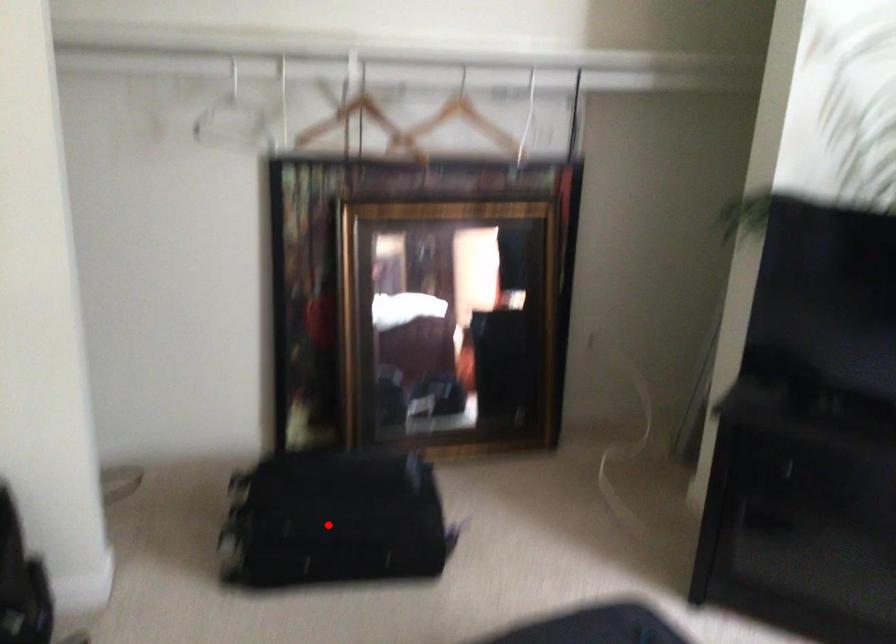
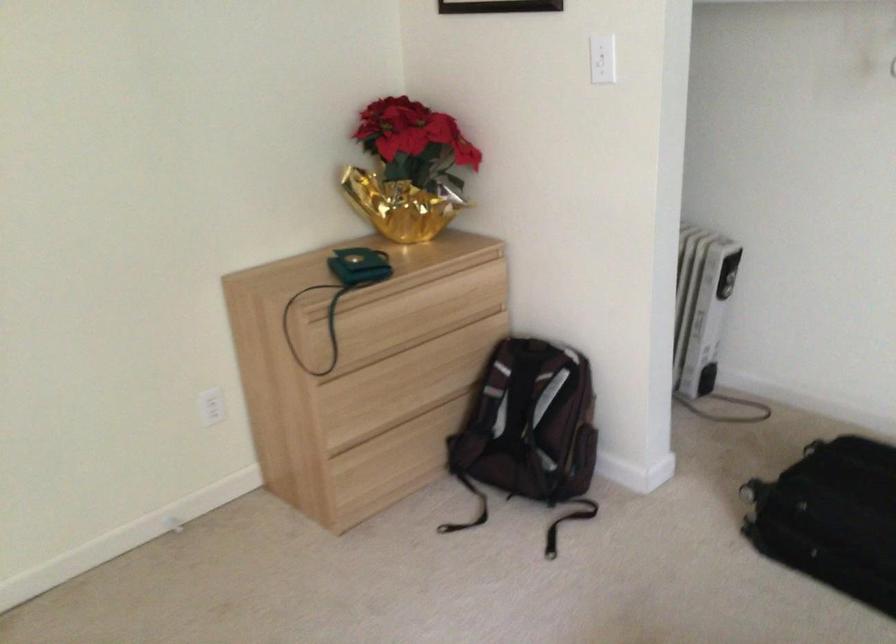
Find the pixel in the second image that matches the highlighted location in the first image.

(831, 518)